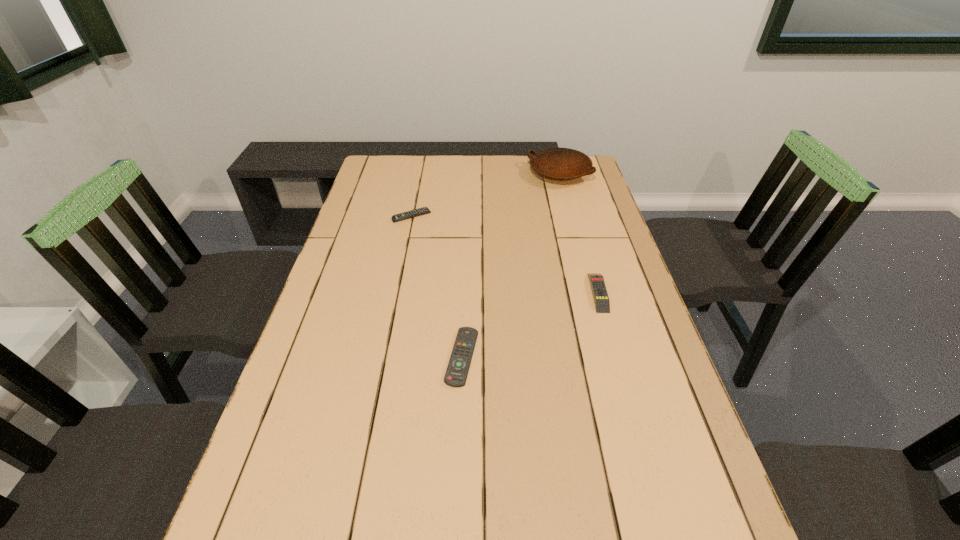
The height and width of the screenshot is (540, 960). I want to click on object that is the closest to the third shortest object, so click(456, 374).

Identify which object is the closest to the farthest remote control. Please provide its 2D coordinates. Your answer should be formatted as a tuple, i.e. [(x, y)], where the tuple contains the x and y coordinates of a point satisfying the conditions above.

[(556, 163)]

Where is `the second closest remote control relative to the nearest remote control`? This screenshot has height=540, width=960. the second closest remote control relative to the nearest remote control is located at coordinates (424, 210).

Identify which remote control is the nearest to the nearest object. Please provide its 2D coordinates. Your answer should be formatted as a tuple, i.e. [(x, y)], where the tuple contains the x and y coordinates of a point satisfying the conditions above.

[(602, 304)]

This screenshot has width=960, height=540. In order to click on free spot that satisfies the following two spatial constraints: 1. on the front side of the leftmost remote control; 2. on the right side of the second remote control from left to right in this screenshot , I will do `click(383, 357)`.

At what (x,y) coordinates should I click in order to perform the action: click on free space that satisfies the following two spatial constraints: 1. on the back side of the third farthest object; 2. on the left side of the nearest remote control. Please return your answer as a coordinate pair (x, y). The width and height of the screenshot is (960, 540). Looking at the image, I should click on (465, 292).

The width and height of the screenshot is (960, 540). I want to click on free space that satisfies the following two spatial constraints: 1. on the front side of the second nearest remote control; 2. on the right side of the leftmost object, so click(396, 292).